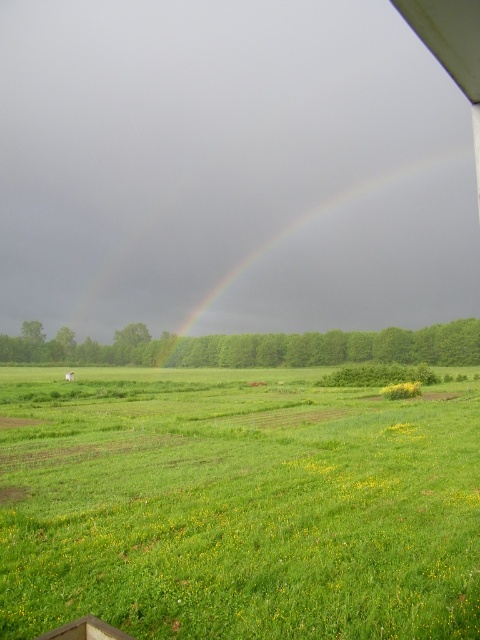
Question: Can you confirm if green grassy field at lower center is positioned to the right of rainbow at center?

Choices:
 (A) yes
 (B) no

Answer: (B)

Question: Is green grassy field at lower center thinner than rainbow at center?

Choices:
 (A) no
 (B) yes

Answer: (B)

Question: Which point is closer to the camera?

Choices:
 (A) green grassy field at lower center
 (B) rainbow at center

Answer: (A)

Question: Is green grassy field at lower center behind rainbow at center?

Choices:
 (A) no
 (B) yes

Answer: (A)

Question: Which object is closer to the camera taking this photo?

Choices:
 (A) green grassy field at lower center
 (B) rainbow at center

Answer: (A)

Question: Which point is farther from the camera taking this photo?

Choices:
 (A) (72, 570)
 (B) (373, 273)

Answer: (B)